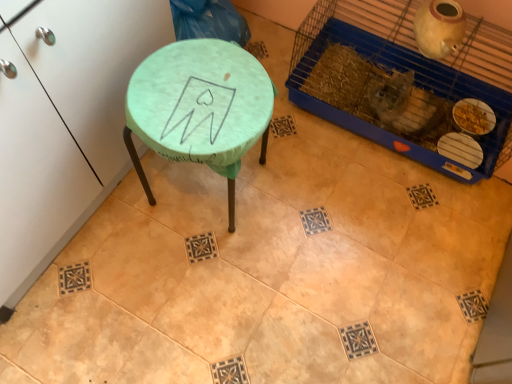
The image size is (512, 384). In order to click on free space in front of matte green stool at center in this screenshot , I will do `click(196, 278)`.